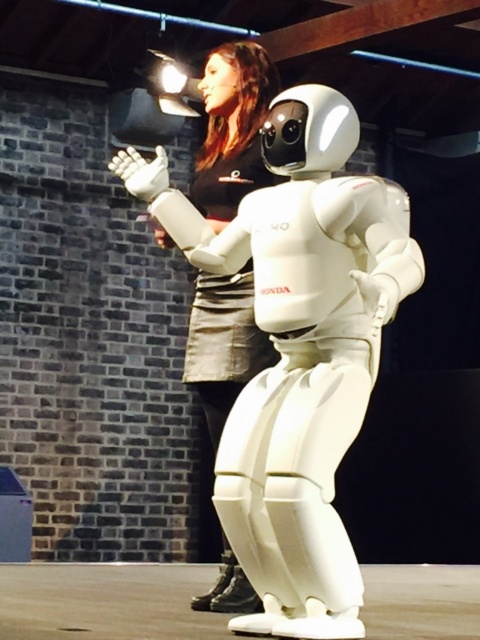
You are a fashion designer observing a humanoid robot and a person on a stage. The robot has a white sleek design with a rounded head and black visor. The person is wearing a black top and light skirt. There is a point at coordinates (x=231, y=129). Which object is this point located on?

The point at coordinates (x=231, y=129) is located on the matte black dress at upper center.

You are a fashion designer observing a stage setup. You notice two dresses displayed on mannequins. The first is the matte black dress at upper center, and the second is the black matte dress at center. Which dress is positioned to the left of the other?

The matte black dress at upper center is to the left of the black matte dress at center.

You are organizing a fashion show and need to decide which dress to feature based on size. Given the scene with a humanoid robot and a person on stage, which dress between the matte black dress at upper center and the black matte dress at center should you choose if you want the larger one?

The matte black dress at upper center has a larger size compared to the black matte dress at center, so you should choose the matte black dress at upper center.